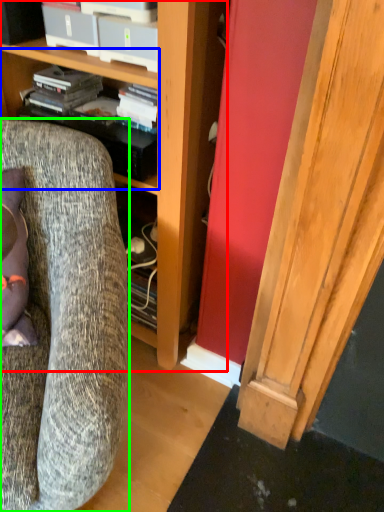
Question: Based on their relative distances, which object is nearer to cabinetry (highlighted by a red box)? Choose from shelf (highlighted by a blue box) and chair (highlighted by a green box).

Choices:
 (A) shelf
 (B) chair

Answer: (A)